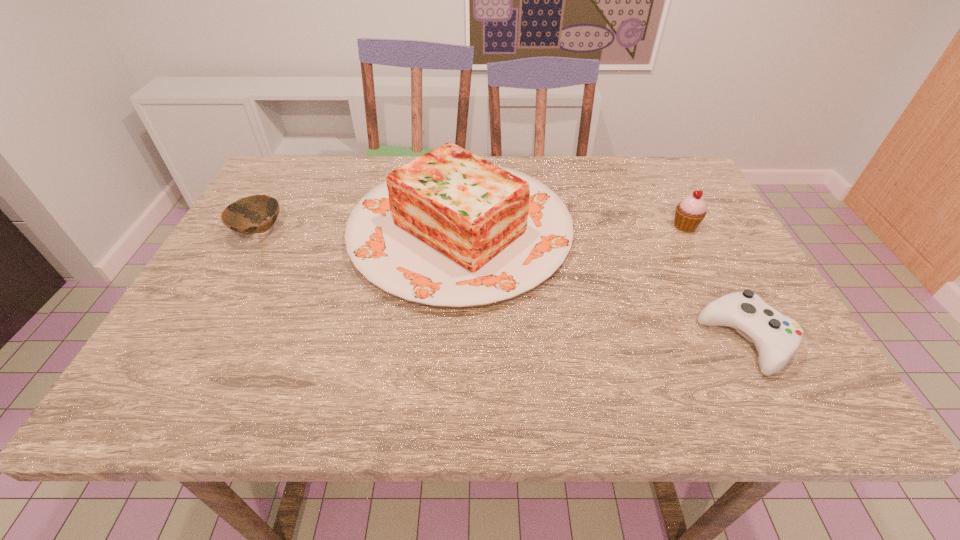
Locate an element on the screen. The width and height of the screenshot is (960, 540). free space that satisfies the following two spatial constraints: 1. on the back side of the bowl; 2. on the right side of the third shortest object is located at coordinates (263, 226).

Identify the location of blank area in the image that satisfies the following two spatial constraints: 1. on the back side of the cupcake; 2. on the left side of the lasagna. (461, 226).